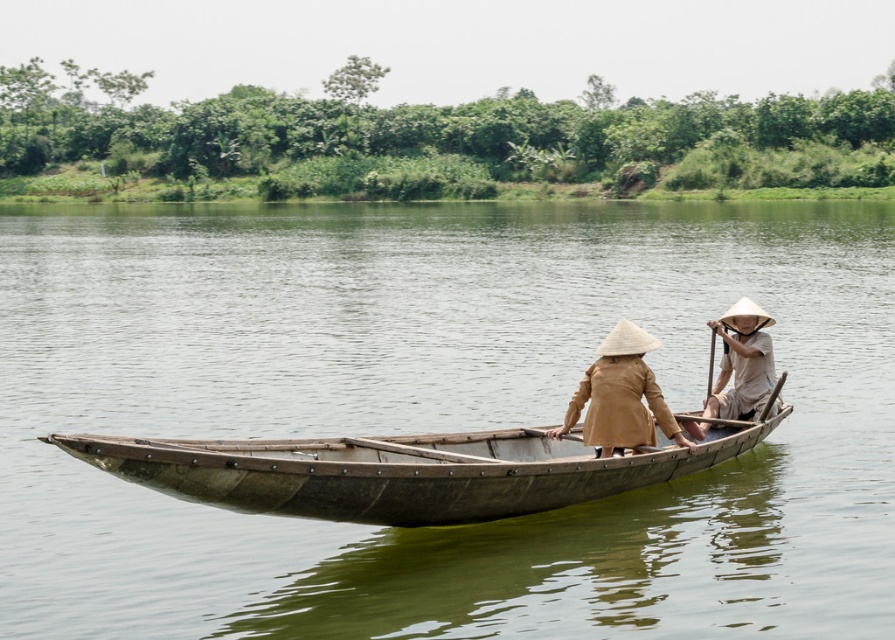
Question: Estimate the real-world distances between objects in this image. Which object is closer to the greenish-brown water at center?

Choices:
 (A) wooden canoe at center
 (B) brown matte conical hat at center
 (C) light brown wooden paddle at right

Answer: (B)

Question: Which of the following is the closest to the observer?

Choices:
 (A) (435, 611)
 (B) (752, 355)

Answer: (A)

Question: Observing the image, what is the correct spatial positioning of greenish-brown water at center in reference to brown matte conical hat at center?

Choices:
 (A) above
 (B) below

Answer: (A)

Question: Which point is closer to the camera?

Choices:
 (A) (747, 401)
 (B) (405, 502)
 (C) (661, 605)

Answer: (C)

Question: Can you confirm if greenish-brown water at center is thinner than brown matte conical hat at center?

Choices:
 (A) no
 (B) yes

Answer: (A)

Question: Considering the relative positions of greenish-brown water at center and wooden canoe at center in the image provided, where is greenish-brown water at center located with respect to wooden canoe at center?

Choices:
 (A) left
 (B) right

Answer: (A)